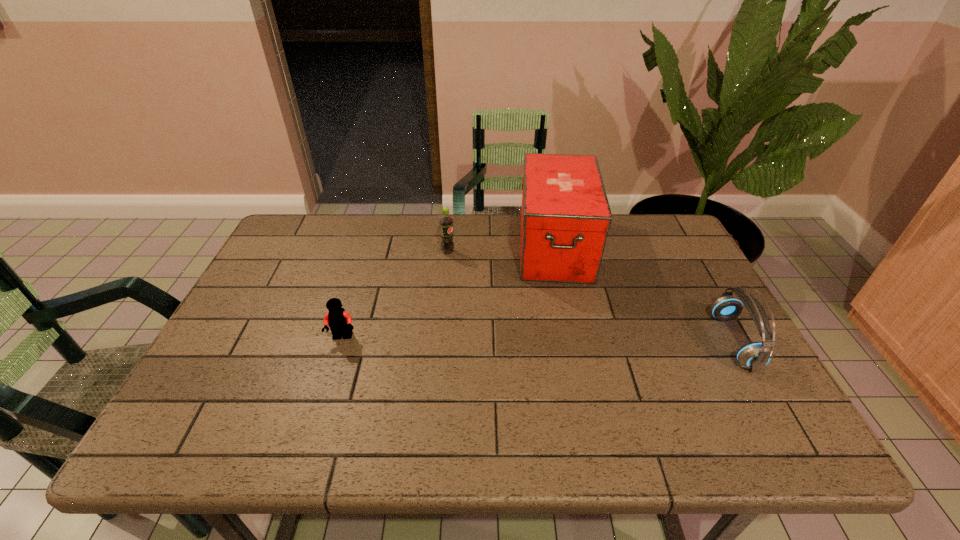
Locate an element on the screen. The width and height of the screenshot is (960, 540). vacant spot on the desktop that is between the shortest object and the rightmost object and is positioned on the handle side of the tallest object is located at coordinates (563, 340).

Find the location of a particular element. free space on the desktop that is between the shortest object and the rightmost object and is positioned on the front label of the second object from left to right is located at coordinates (596, 340).